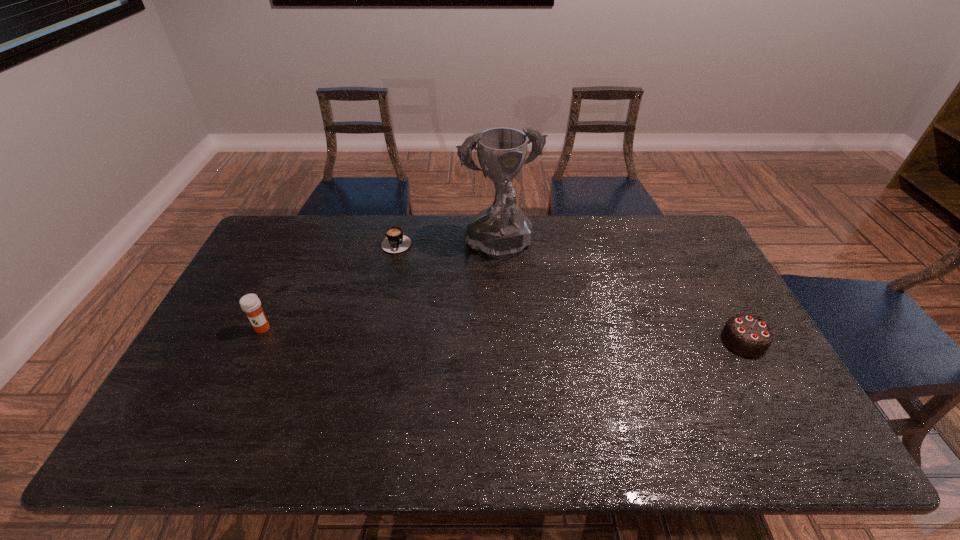
The image size is (960, 540). Find the location of `vacant space at the far edge of the desktop`. vacant space at the far edge of the desktop is located at coordinates (644, 234).

Locate an element on the screen. vacant region at the near edge is located at coordinates (457, 394).

Image resolution: width=960 pixels, height=540 pixels. In the image, there is a desktop. Identify the location of vacant space at the left edge. (194, 383).

In order to click on free region at the right edge in this screenshot , I will do `click(759, 356)`.

You are a GUI agent. You are given a task and a screenshot of the screen. Output one action in this format:
    pyautogui.click(x=<x>, y=<y>)
    Task: Click on the vacant space at the far left corner of the desktop
    The image size is (960, 540).
    Given the screenshot: What is the action you would take?
    pyautogui.click(x=301, y=239)

Locate an element on the screen. This screenshot has height=540, width=960. free space at the near left corner is located at coordinates (196, 404).

The height and width of the screenshot is (540, 960). In the image, there is a desktop. Find the location of `vacant space at the far right corner`. vacant space at the far right corner is located at coordinates (645, 219).

Where is `free point between the award and the shortest object`? The image size is (960, 540). free point between the award and the shortest object is located at coordinates (448, 245).

You are a GUI agent. You are given a task and a screenshot of the screen. Output one action in this format:
    pyautogui.click(x=<x>, y=<y>)
    Task: Click on the vacant area between the cappuccino and the award
    
    Given the screenshot: What is the action you would take?
    pyautogui.click(x=448, y=245)

This screenshot has width=960, height=540. Identify the location of vacant space in between the rightmost object and the shortest object. (570, 291).